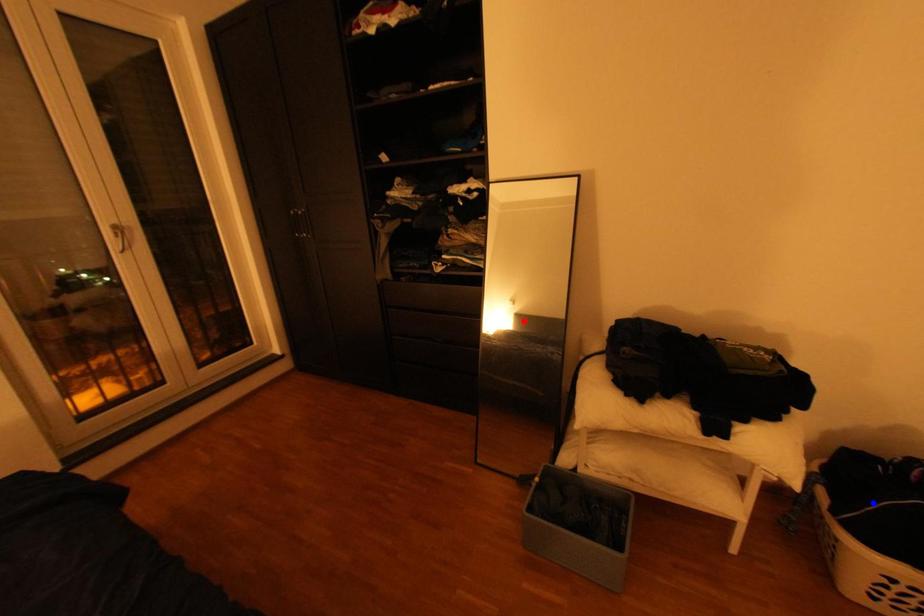
Question: In the image, two points are highlighted. Which point is nearer to the camera? Reply with the corresponding letter.

Choices:
 (A) blue point
 (B) red point

Answer: (A)